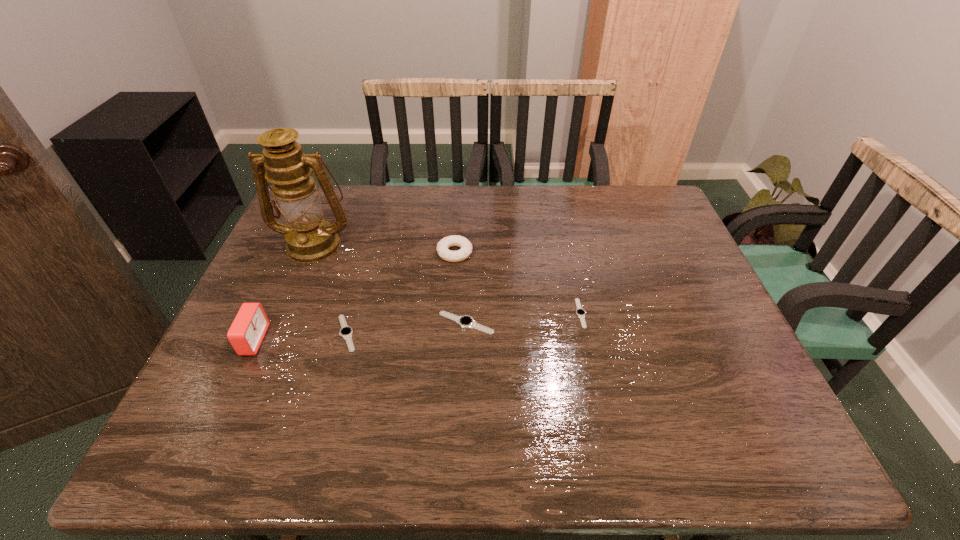
This screenshot has height=540, width=960. I want to click on vacant space at the near edge of the desktop, so click(630, 410).

Where is `free space at the right edge`? free space at the right edge is located at coordinates (685, 274).

In the image, there is a desktop. At what (x,y) coordinates should I click in order to perform the action: click on vacant space at the far right corner. Please return your answer as a coordinate pair (x, y). Image resolution: width=960 pixels, height=540 pixels. Looking at the image, I should click on (646, 205).

Where is `vacant space at the near right corner`? vacant space at the near right corner is located at coordinates (732, 404).

Where is `free space between the tallest object and the rightmost object`? This screenshot has width=960, height=540. free space between the tallest object and the rightmost object is located at coordinates (447, 279).

Image resolution: width=960 pixels, height=540 pixels. Identify the location of free space between the second tallest object and the oil lamp. (x=284, y=292).

At what (x,y) coordinates should I click in order to perform the action: click on empty space that is in between the second tallest object and the doughnut. Please return your answer as a coordinate pair (x, y). This screenshot has width=960, height=540. Looking at the image, I should click on (354, 296).

At what (x,y) coordinates should I click in order to perform the action: click on vacant area that lies between the fifth shortest object and the oil lamp. Please return your answer as a coordinate pair (x, y). This screenshot has height=540, width=960. Looking at the image, I should click on (284, 292).

Where is `vacant area between the second watch from left to right and the second shortest watch`? vacant area between the second watch from left to right and the second shortest watch is located at coordinates (406, 328).

What are the coordinates of `unoccupied position between the second watch from right to left and the doughnut` in the screenshot? It's located at (461, 288).